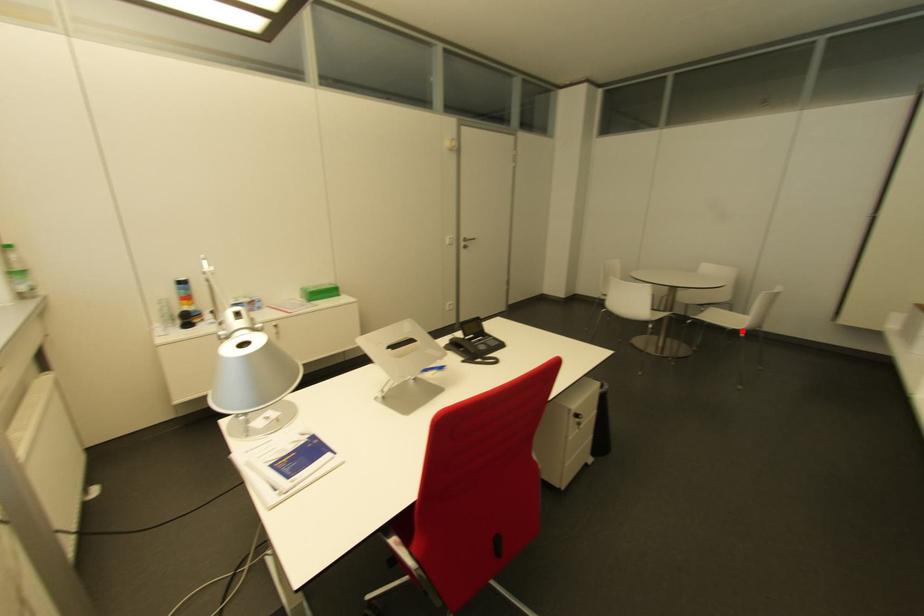
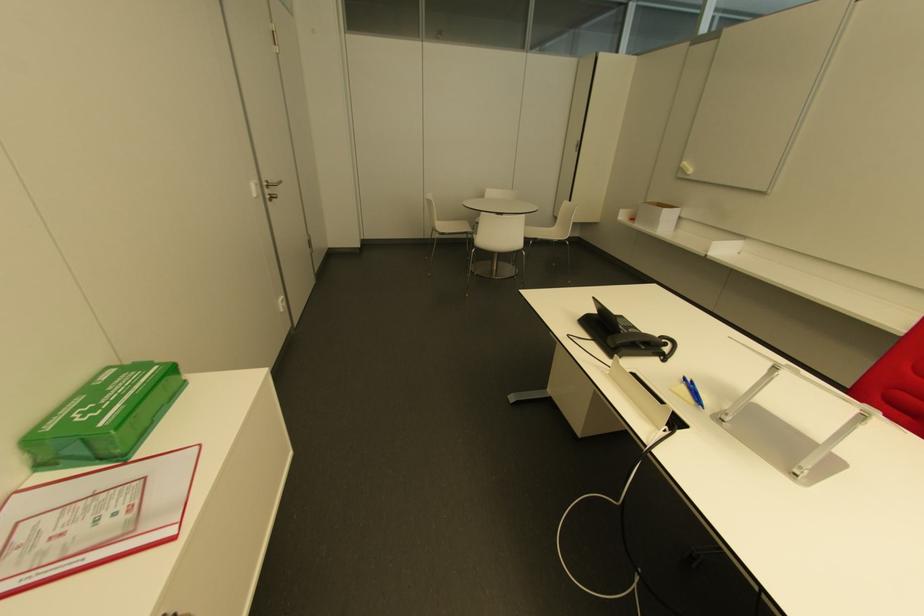
Question: I am providing you with two images of the same scene from different viewpoints. In image1, a red point is highlighted. Considering the same 3D point in image2, which of the following is correct?

Choices:
 (A) It is closer
 (B) It is farther

Answer: (A)